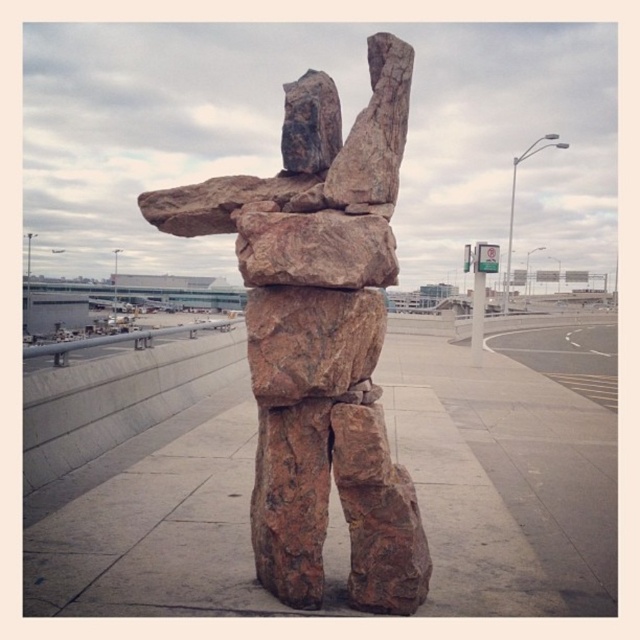
Question: Which point is farther to the camera?

Choices:
 (A) (280, 586)
 (B) (557, 573)

Answer: (B)

Question: Is brown stone pavement at center below brown rock sculpture at center?

Choices:
 (A) no
 (B) yes

Answer: (B)

Question: Is brown stone pavement at center behind brown rock sculpture at center?

Choices:
 (A) yes
 (B) no

Answer: (A)

Question: Which point is farther to the camera?

Choices:
 (A) brown stone pavement at center
 (B) brown rock sculpture at center

Answer: (A)

Question: Which point is farther to the camera?

Choices:
 (A) brown rock sculpture at center
 (B) brown stone pavement at center

Answer: (B)

Question: Does brown stone pavement at center appear over brown rock sculpture at center?

Choices:
 (A) no
 (B) yes

Answer: (A)